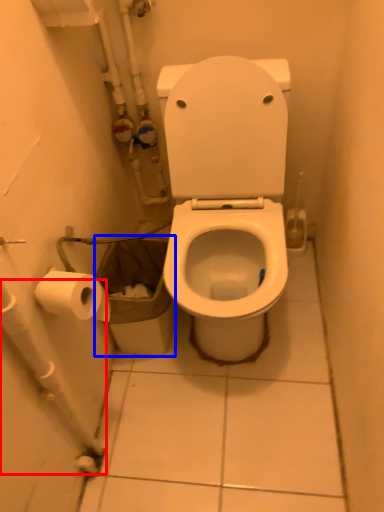
Question: Which object appears farthest to the camera in this image, water pipe (highlighted by a red box) or garbage (highlighted by a blue box)?

Choices:
 (A) water pipe
 (B) garbage

Answer: (B)